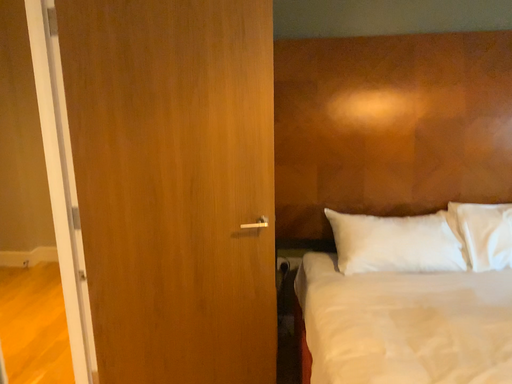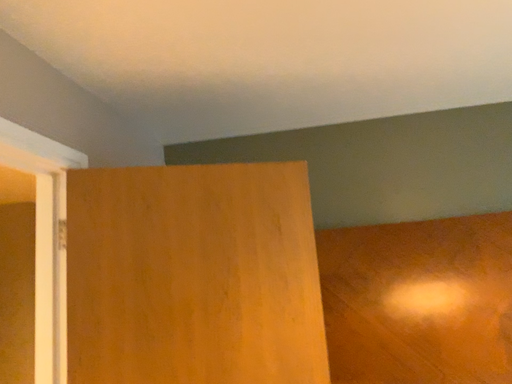
Question: Which way did the camera rotate in the video?

Choices:
 (A) rotated downward
 (B) rotated upward

Answer: (B)